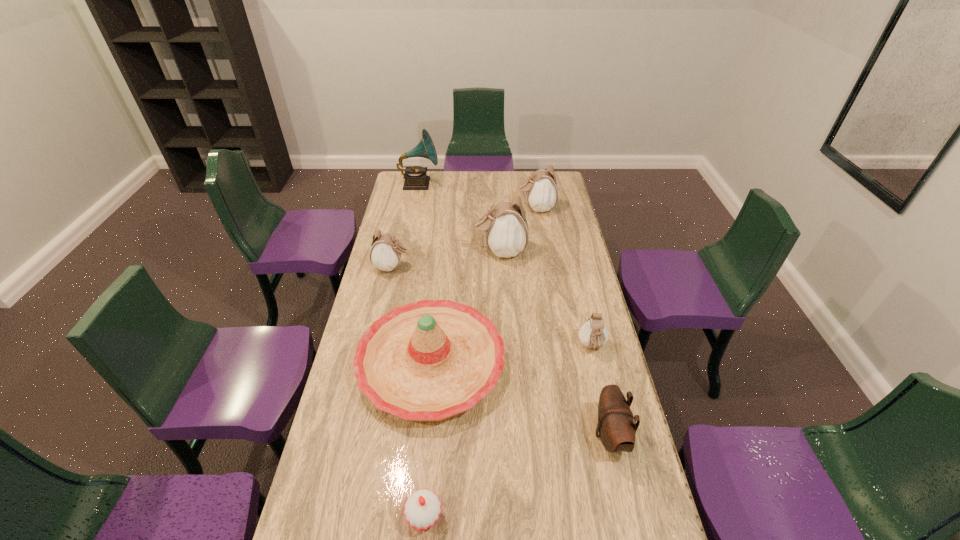
The image size is (960, 540). What are the coordinates of `object that is at the far left corner` in the screenshot? It's located at (416, 178).

Locate an element on the screen. The image size is (960, 540). free space at the far edge is located at coordinates (466, 183).

Find the location of a particular element. free space at the left edge of the desktop is located at coordinates (347, 423).

I want to click on vacant space at the right edge, so click(x=599, y=537).

Image resolution: width=960 pixels, height=540 pixels. I want to click on free space at the far left corner of the desktop, so click(403, 179).

You are a GUI agent. You are given a task and a screenshot of the screen. Output one action in this format:
    pyautogui.click(x=<x>, y=<y>)
    Task: Click on the empty space that is in between the leftmost pouch and the farthest object
    
    Given the screenshot: What is the action you would take?
    pyautogui.click(x=406, y=226)

Where is `free area in between the biggest white pouch and the nearest pouch`? The height and width of the screenshot is (540, 960). free area in between the biggest white pouch and the nearest pouch is located at coordinates (555, 343).

The height and width of the screenshot is (540, 960). I want to click on vacant space that's between the brown pouch and the sombrero, so click(520, 400).

This screenshot has width=960, height=540. What are the coordinates of `free area in between the second shortest object and the second smallest white pouch` in the screenshot? It's located at (492, 307).

The height and width of the screenshot is (540, 960). Identify the location of empty location between the farthest object and the shortest pouch. (506, 265).